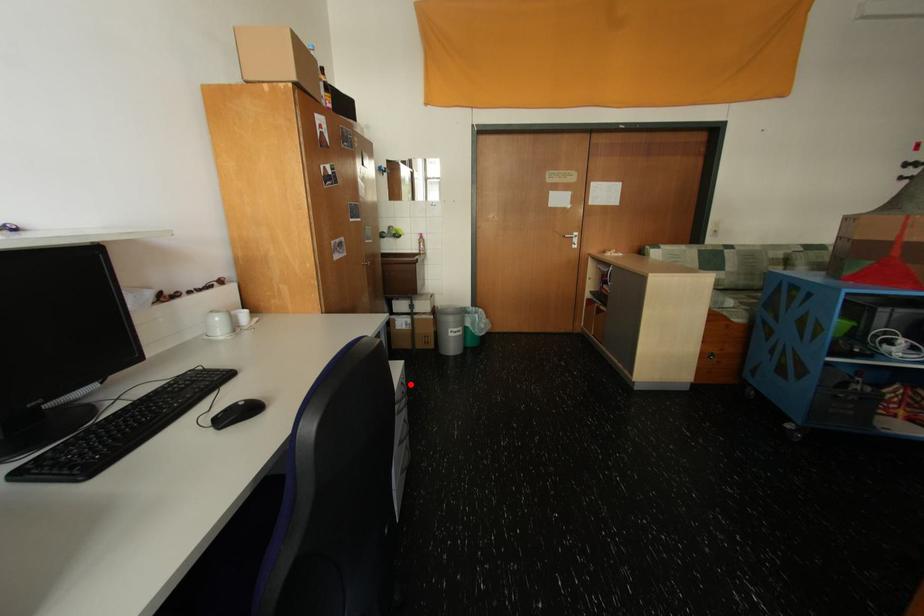
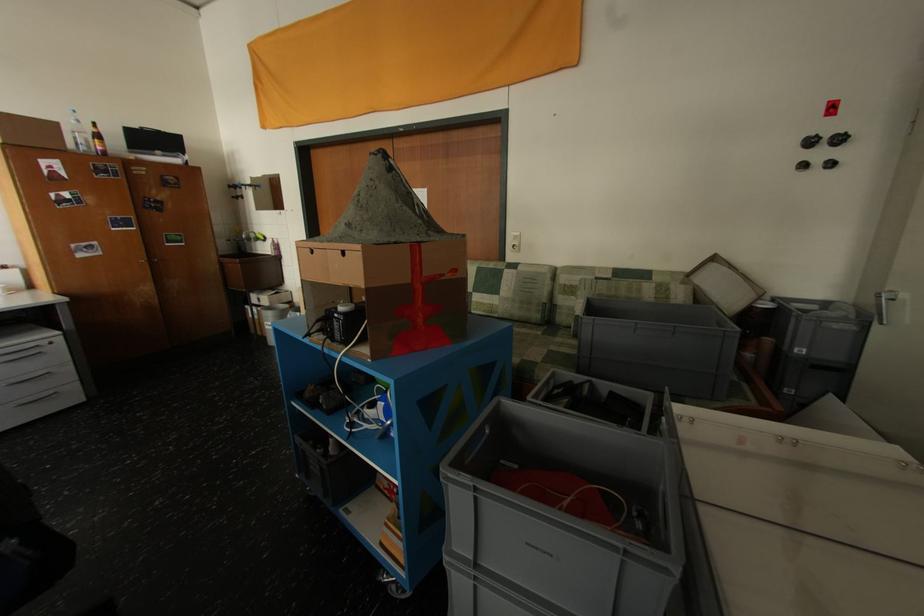
Question: I am providing you with two images of the same scene from different viewpoints. Image1 has a red point marked. In image2, the corresponding 3D location appears at what relative position? Reply with the corresponding letter.

Choices:
 (A) Closer
 (B) Farther

Answer: (B)